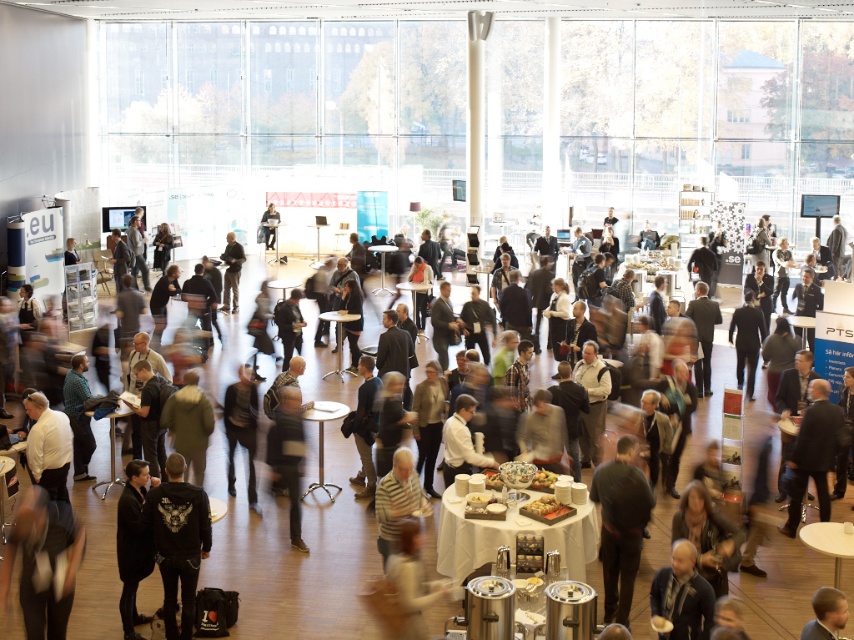
You are an event planner organizing a photo shoot. You need to position a camera to capture both the dark brown leather jacket at center and the dark gray suit at center in the same frame. Based on their positions, where should you place the camera relative to the two items to ensure both are visible?

The dark brown leather jacket at center is positioned on the right side of dark gray suit at center. To capture both in the same frame, the camera should be placed to the left of the dark gray suit at center so that the dark brown leather jacket at center on the right and the dark gray suit at center are both within the camera view.

You are organizing a seating arrangement for a conference and need to place a name tag on the table closest to the dark gray jacket at center. Where should you place the name tag?

The name tag should be placed on the table closest to the dark gray jacket at center, which is located at point (231, 272).

You are an event planner organizing a photo shoot in the described space. You need to position two models wearing the dark gray jacket at center and the dark gray suit at center such that one is above the other. Which clothing item should be placed higher to comply with their current spatial arrangement?

The dark gray suit at center should be placed higher because the dark gray jacket at center is below it in the current arrangement.